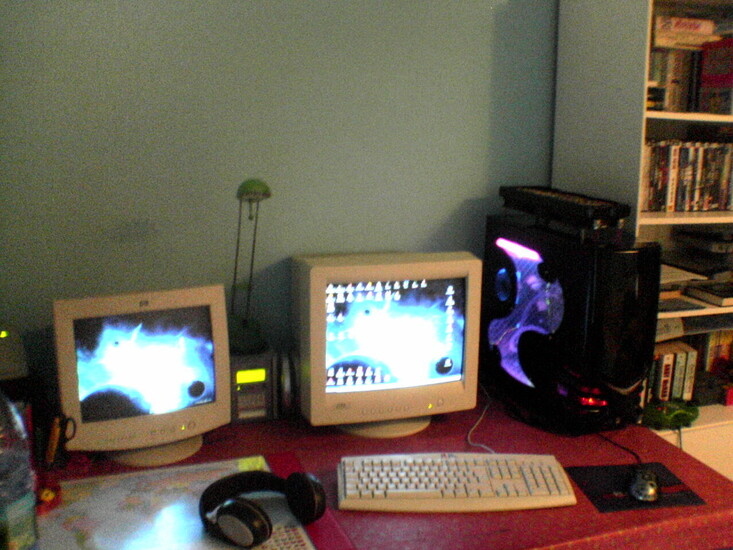
Identify the location of computer mouse. (644, 488).